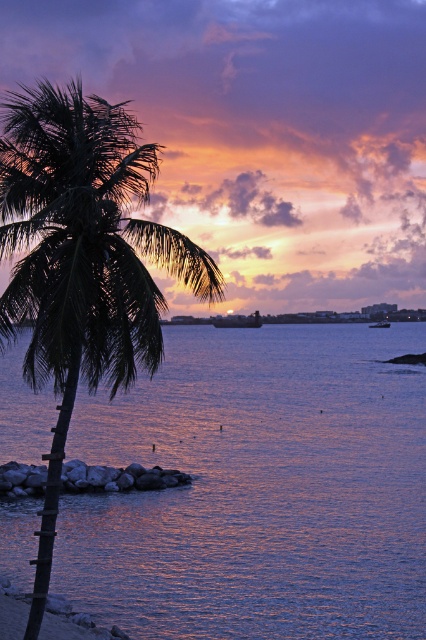
You are planning to dock a small wooden boat at center in the sunset scene. The boat requires a minimum width of 5 meters to safely maneuver. Can the purple reflective water at center accommodate the boat?

The purple reflective water at center might be wider than wooden boat at center, so there is a possibility that it can accommodate the boat. However, the exact width isn

You are an artist planning to paint the sunset scene. You want to ensure the purple reflective water at center and the metallic gray boat at center are proportionally accurate. Which object should you paint larger?

The purple reflective water at center should be painted larger since it is bigger than the metallic gray boat at center according to the description.

You are standing on the beach and see the purple reflective water at center and the wooden boat at center. Which object is directly above the other?

The wooden boat at center is directly above the purple reflective water at center because the boat is positioned over the water.